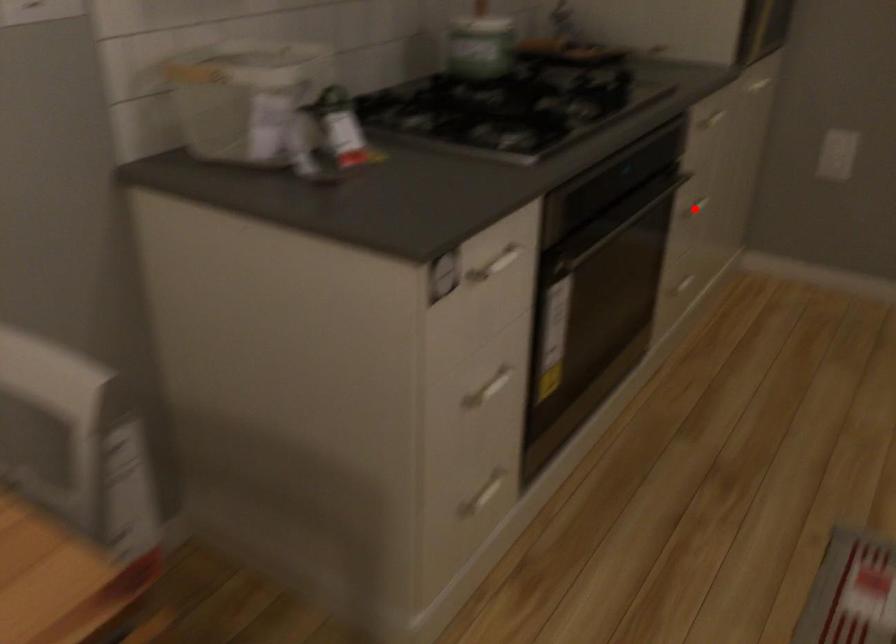
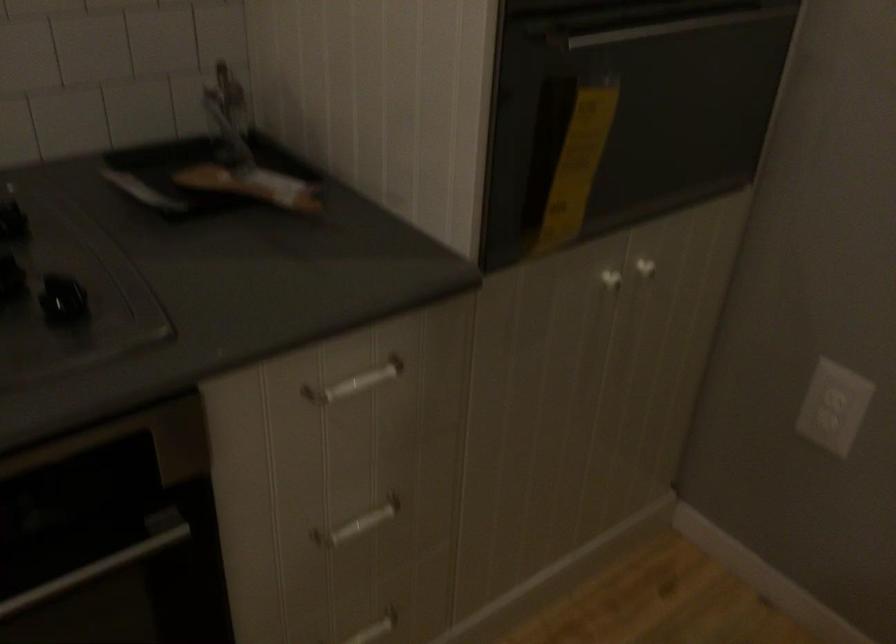
Where in the second image is the point corresponding to the highlighted location from the first image?

(358, 524)